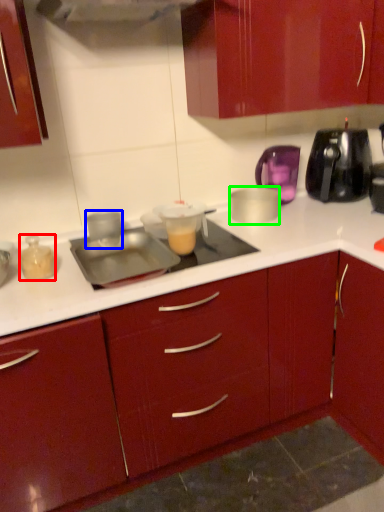
Question: Based on their relative distances, which object is farther from kitchen appliance (highlighted by a red box)? Choose from kitchen appliance (highlighted by a blue box) and kitchen appliance (highlighted by a green box).

Choices:
 (A) kitchen appliance
 (B) kitchen appliance

Answer: (B)